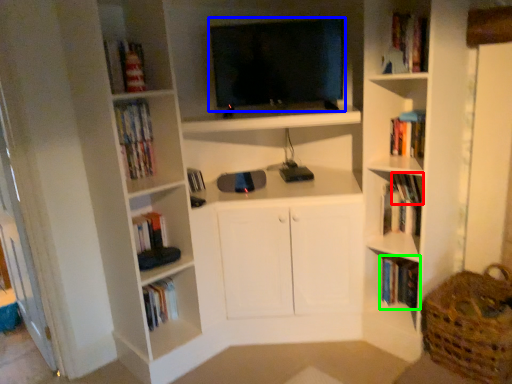
Question: Considering the real-world distances, which object is closest to book (highlighted by a red box)? television (highlighted by a blue box) or book (highlighted by a green box).

Choices:
 (A) television
 (B) book

Answer: (B)